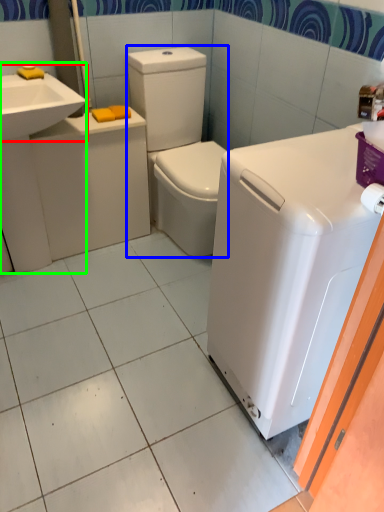
Question: Which object is positioned farthest from sink (highlighted by a red box)? Select from washer (highlighted by a blue box) and sink (highlighted by a green box).

Choices:
 (A) washer
 (B) sink

Answer: (A)